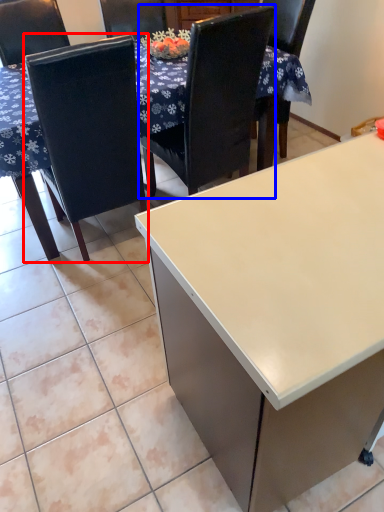
Question: Among these objects, which one is farthest to the camera, chair (highlighted by a red box) or chair (highlighted by a blue box)?

Choices:
 (A) chair
 (B) chair

Answer: (B)